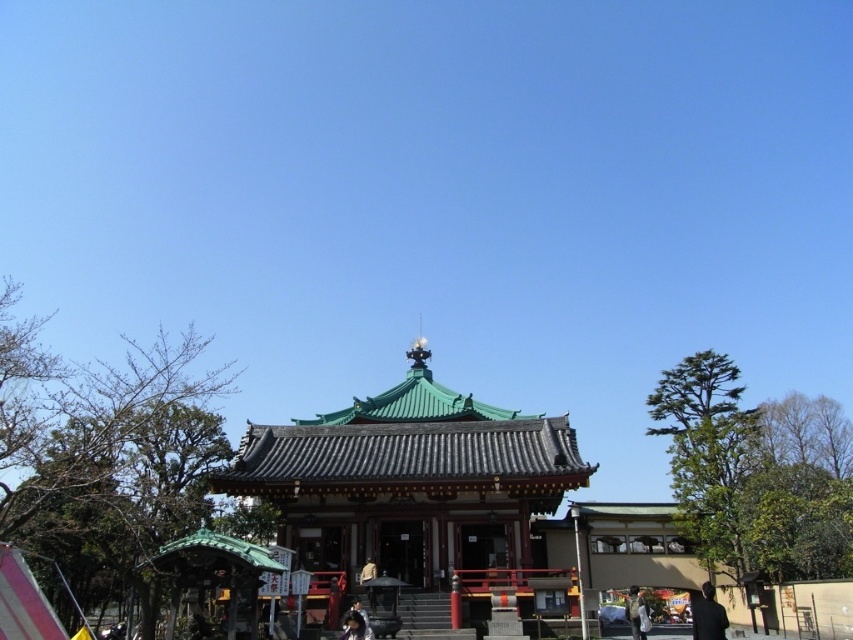
Question: Can you confirm if green tile roof pagoda at center is positioned to the right of camouflage fabric jacket at lower right?

Choices:
 (A) no
 (B) yes

Answer: (A)

Question: Which point appears closest to the camera in this image?

Choices:
 (A) (709, 593)
 (B) (631, 589)
 (C) (315, 442)

Answer: (A)

Question: Is green tile roof pagoda at center smaller than black fabric person at lower right?

Choices:
 (A) no
 (B) yes

Answer: (A)

Question: Which of the following is the farthest from the observer?

Choices:
 (A) black fabric person at lower right
 (B) camouflage fabric jacket at lower right

Answer: (B)

Question: Is black fabric person at lower right closer to the viewer compared to camouflage fabric jacket at lower right?

Choices:
 (A) no
 (B) yes

Answer: (B)

Question: Which object is positioned farthest from the black fabric person at lower right?

Choices:
 (A) green tile roof pagoda at center
 (B) camouflage fabric jacket at lower right

Answer: (A)